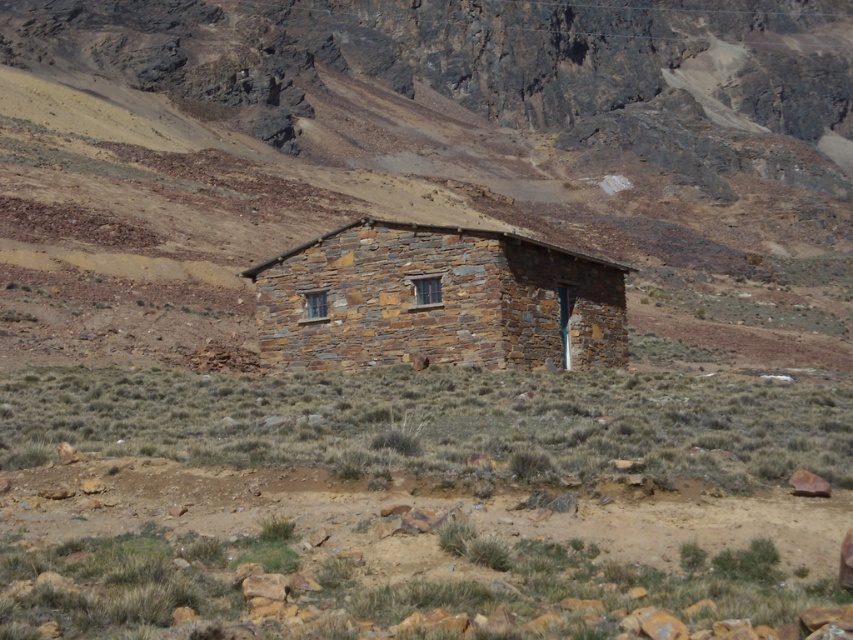
You are a traveler who needs to set up a tent in the brown rocky terrain at center. Considering the size of the terrain and the rustic stone hut at center, will there be enough space to set up your tent without it overlapping the hut?

The brown rocky terrain at center is larger than the rustic stone hut at center, so there should be enough space to set up the tent without overlapping the hut.

You are standing in the middle of the brown rocky terrain at center and want to enter the rustic stone hut at center. Which direction should you move to reach the entrance?

The rustic stone hut at center is taller than the brown rocky terrain at center, so you should move towards the higher elevation where the rustic stone hut at center is located to reach the entrance.